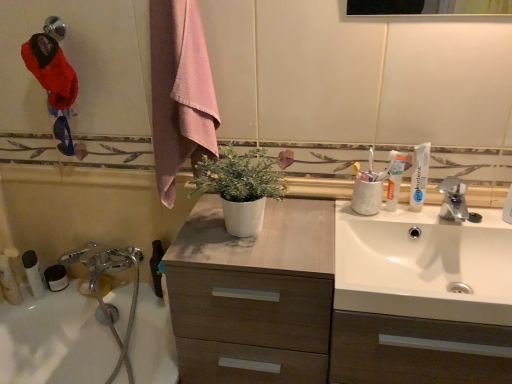
Where is `vacant space situated on the left part of white matte toothpaste at upper right, the second toothpaste viewed from the right`? vacant space situated on the left part of white matte toothpaste at upper right, the second toothpaste viewed from the right is located at coordinates (328, 218).